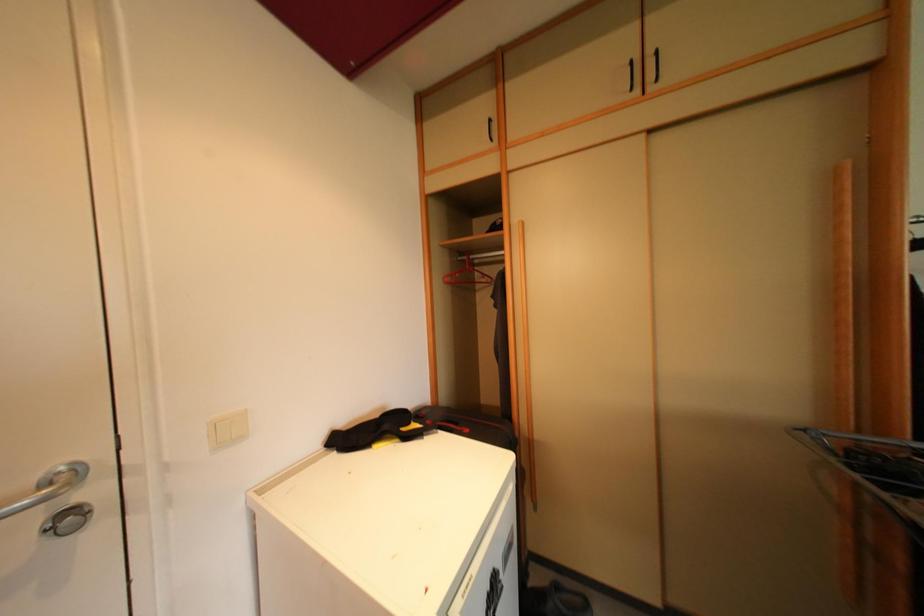
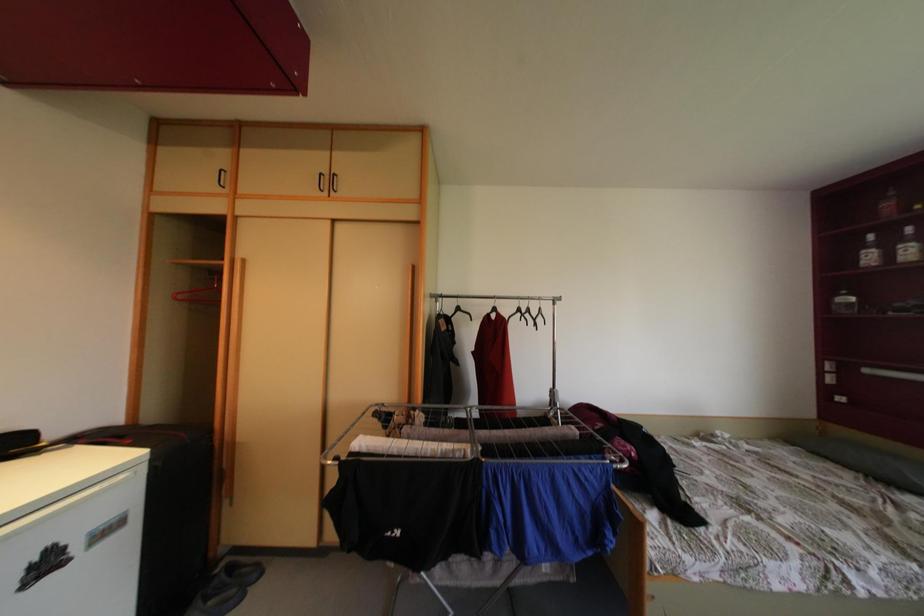
Which direction would the cameraman need to move to produce the second image?

The cameraman walked toward right, backward.